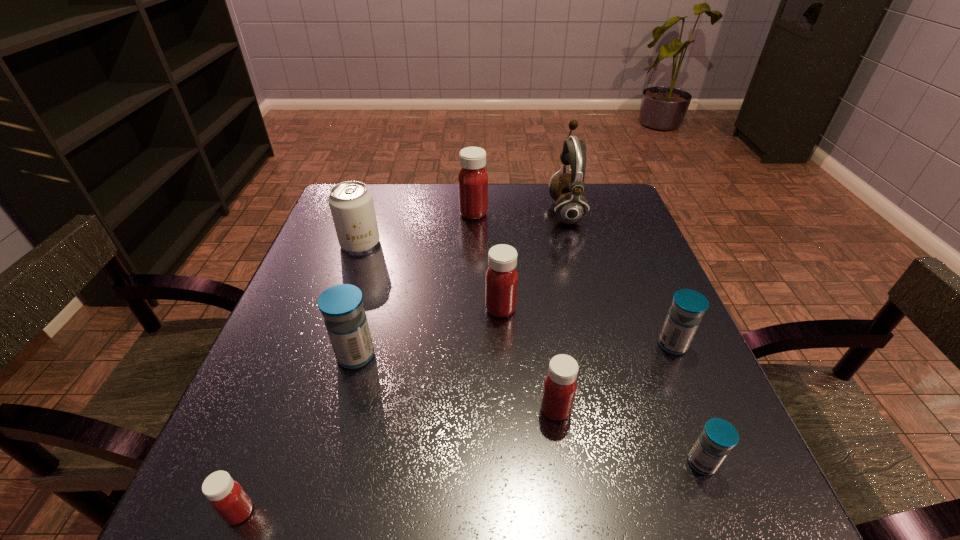
In order to click on the seventh farthest object in this screenshot , I will do `click(560, 385)`.

Image resolution: width=960 pixels, height=540 pixels. I want to click on the fourth object from right to left, so click(560, 385).

Locate an element on the screen. Image resolution: width=960 pixels, height=540 pixels. the eighth farthest object is located at coordinates (718, 437).

I want to click on the nearest blue medicine, so click(x=718, y=437).

Where is `the nearest red medicine`? This screenshot has height=540, width=960. the nearest red medicine is located at coordinates (226, 496).

Locate an element on the screen. The width and height of the screenshot is (960, 540). the smallest red medicine is located at coordinates (226, 496).

Find the location of a particular element. free location located on the ear pads of the brown earphone is located at coordinates (510, 211).

Where is `vacant area situated on the ear pads of the brown earphone`? vacant area situated on the ear pads of the brown earphone is located at coordinates (451, 211).

You are a GUI agent. You are given a task and a screenshot of the screen. Output one action in this format:
    pyautogui.click(x=<x>, y=<y>)
    Task: Click on the free space located 0.370m on the ear pads of the brown earphone
    
    Given the screenshot: What is the action you would take?
    pyautogui.click(x=415, y=211)

At what (x,y) coordinates should I click in order to perform the action: click on vacant point located 0.050m on the back of the biggest red medicine. Please return your answer as a coordinate pair (x, y). The image size is (960, 540). Looking at the image, I should click on (474, 197).